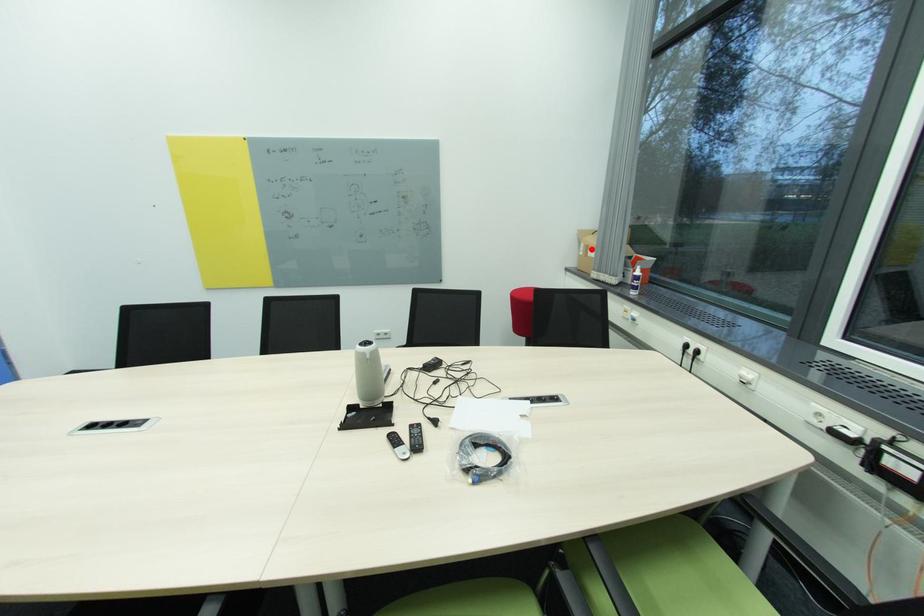
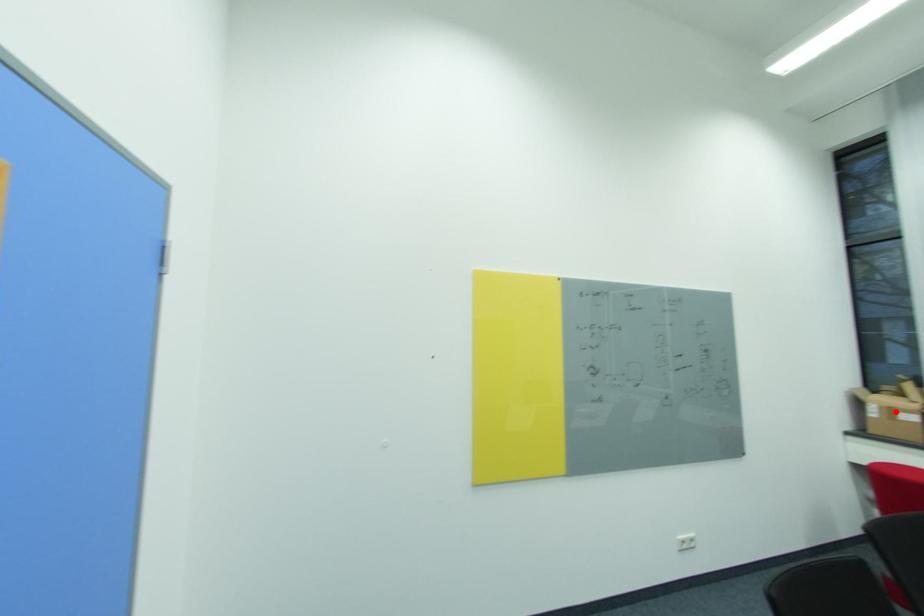
I am providing you with two images of the same scene from different viewpoints. A red point is marked on the first image and another point is marked on the second image. Does the point marked in image1 correspond to the same location as the one in image2?

Yes